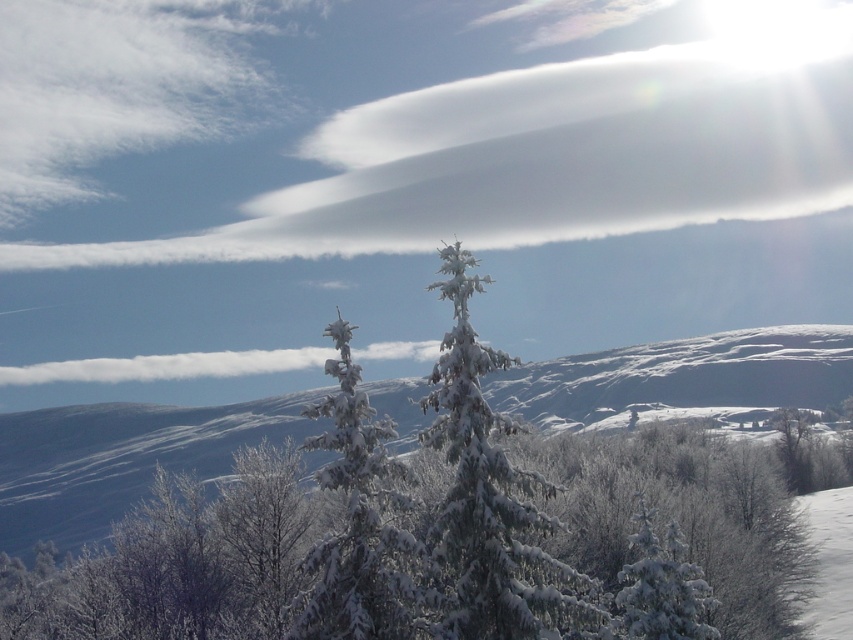
Where is `white fluffy cloud at upper center`? Image resolution: width=853 pixels, height=640 pixels. white fluffy cloud at upper center is located at coordinates (560, 148).

Is white fluffy cloud at upper center to the right of white frosty tree at center from the viewer's perspective?

Correct, you'll find white fluffy cloud at upper center to the right of white frosty tree at center.

This screenshot has height=640, width=853. Describe the element at coordinates (560, 148) in the screenshot. I see `white fluffy cloud at upper center` at that location.

At what (x,y) coordinates should I click in order to perform the action: click on white fluffy cloud at upper center. Please return your answer as a coordinate pair (x, y). The width and height of the screenshot is (853, 640). Looking at the image, I should click on (560, 148).

Who is taller, white fluffy cloud at upper center or snow-covered evergreen at center?

With more height is white fluffy cloud at upper center.

Can you confirm if white fluffy cloud at upper center is bigger than snow-covered evergreen at center?

Yes, white fluffy cloud at upper center is bigger than snow-covered evergreen at center.

Between point (735, 99) and point (546, 573), which one is positioned behind?

The point (735, 99) is behind.

What are the coordinates of `white fluffy cloud at upper center` in the screenshot? It's located at (560, 148).

How much distance is there between snow-covered evergreen at center and white frosty tree at center?

A distance of 7.25 feet exists between snow-covered evergreen at center and white frosty tree at center.

Is snow-covered evergreen at center behind white frosty tree at center?

Yes, snow-covered evergreen at center is behind white frosty tree at center.

Is point (543, 520) behind point (364, 545)?

No, it is in front of (364, 545).

Find the location of a particular element. snow-covered evergreen at center is located at coordinates pyautogui.click(x=490, y=499).